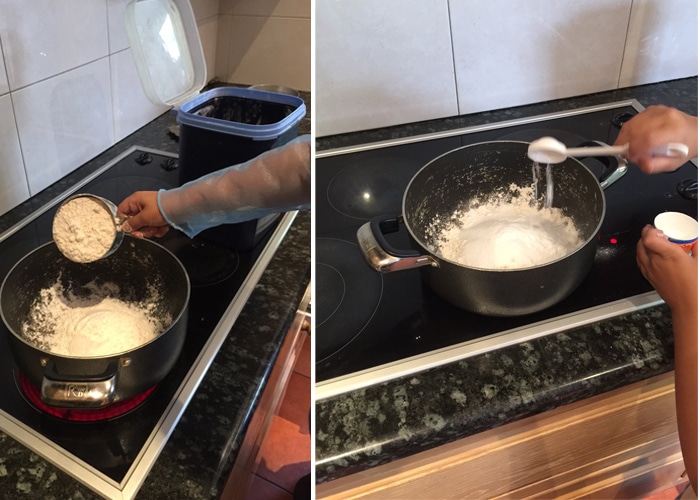
Where is `counter`? This screenshot has width=700, height=500. counter is located at coordinates (504, 385).